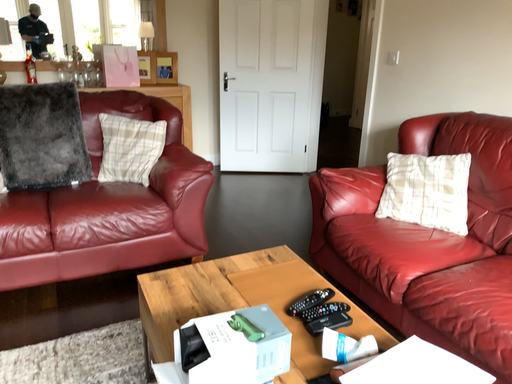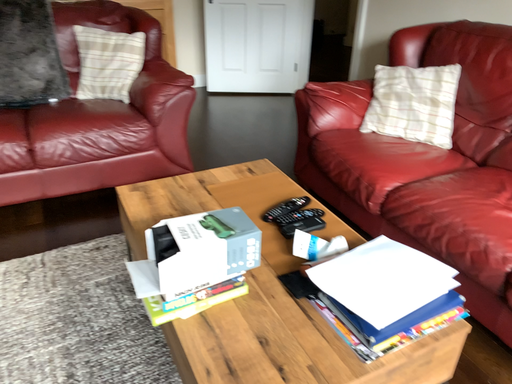
Question: How did the camera likely rotate when shooting the video?

Choices:
 (A) rotated upward
 (B) rotated downward

Answer: (B)